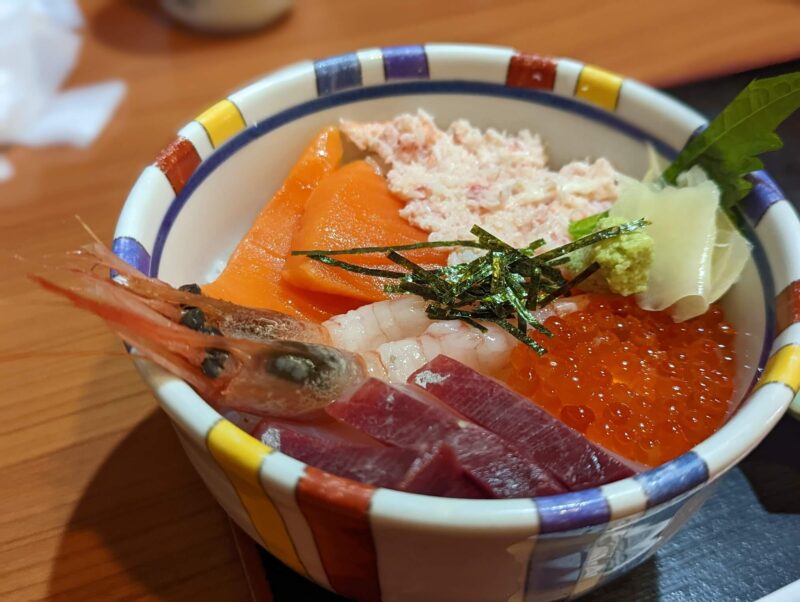
Locate an element on the screen. dark wood lower right corner is located at coordinates (729, 554), (757, 524), (778, 475).